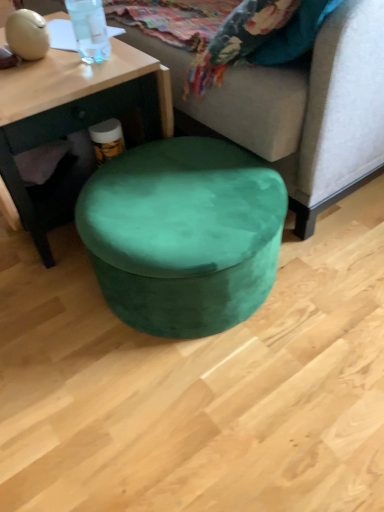
Where is `matte wood coffee table at center`? This screenshot has width=384, height=512. matte wood coffee table at center is located at coordinates (73, 109).

What do you see at coordinates (89, 29) in the screenshot? I see `transparent plastic bottle at upper left` at bounding box center [89, 29].

Find the location of `velvet green ottoman at center`. velvet green ottoman at center is located at coordinates (300, 108).

What do you see at coordinates (183, 234) in the screenshot?
I see `velvet green ottoman at center` at bounding box center [183, 234].

You are a GUI agent. You are given a task and a screenshot of the screen. Output one action in this format:
    pyautogui.click(x=<x>, y=<y>)
    Task: Click on the matte wood coffee table at center
    
    Given the screenshot: What is the action you would take?
    pyautogui.click(x=73, y=109)

Is there a large distance between matte wood coffee table at center and velvet green ottoman at center?

matte wood coffee table at center is near velvet green ottoman at center, not far away.

How many degrees apart are the facing directions of matte wood coffee table at center and velvet green ottoman at center?

The angle between the facing direction of matte wood coffee table at center and the facing direction of velvet green ottoman at center is 0.824 degrees.

Is matte wood coffee table at center positioned beyond the bounds of velvet green ottoman at center?

Yes.

Between point (10, 120) and point (335, 91), which one is positioned behind?

The point (335, 91) is farther.

In terms of width, does matte wood coffee table at center look wider or thinner when compared to velvet green ottoman at center?

matte wood coffee table at center is wider than velvet green ottoman at center.

Can you see matte wood coffee table at center touching velvet green ottoman at center?

They are not placed beside each other.

Could you tell me if matte wood coffee table at center is facing velvet green ottoman at center?

No, matte wood coffee table at center is not aimed at velvet green ottoman at center.

Would you say transparent plastic bottle at upper left is a long distance from velvet green ottoman at center?

No, transparent plastic bottle at upper left is not far away from velvet green ottoman at center.

Which object is closer to the camera, transparent plastic bottle at upper left or velvet green ottoman at center?

velvet green ottoman at center is closer to the camera.

Could you tell me if transparent plastic bottle at upper left is turned towards velvet green ottoman at center?

No, transparent plastic bottle at upper left is not facing towards velvet green ottoman at center.

Based on their sizes in the image, would you say velvet green ottoman at center is bigger or smaller than velvet green ottoman at center?

In the image, velvet green ottoman at center appears to be smaller than velvet green ottoman at center.

Which is more to the left, velvet green ottoman at center or velvet green ottoman at center?

From the viewer's perspective, velvet green ottoman at center appears more on the left side.

How different are the orientations of velvet green ottoman at center and velvet green ottoman at center in degrees?

The angular difference between velvet green ottoman at center and velvet green ottoman at center is 0.824 degrees.

Measure the distance from velvet green ottoman at center to velvet green ottoman at center.

They are 11.46 inches apart.

Which object is further away from the camera, matte wood coffee table at center or transparent plastic bottle at upper left?

matte wood coffee table at center is further away from the camera.

From the image's perspective, between matte wood coffee table at center and transparent plastic bottle at upper left, who is located below?

matte wood coffee table at center, from the image's perspective.

Can transparent plastic bottle at upper left be found inside matte wood coffee table at center?

That's incorrect, transparent plastic bottle at upper left is not inside matte wood coffee table at center.

Looking at their sizes, would you say transparent plastic bottle at upper left is wider or thinner than velvet green ottoman at center?

Considering their sizes, transparent plastic bottle at upper left looks slimmer than velvet green ottoman at center.

From a real-world perspective, which object rests below the other?

velvet green ottoman at center.

Is transparent plastic bottle at upper left further to camera compared to velvet green ottoman at center?

Yes, it is.

Considering the sizes of objects velvet green ottoman at center and velvet green ottoman at center in the image provided, who is shorter, velvet green ottoman at center or velvet green ottoman at center?

velvet green ottoman at center is shorter.

How different are the orientations of velvet green ottoman at center and velvet green ottoman at center in degrees?

The angle between the facing direction of velvet green ottoman at center and the facing direction of velvet green ottoman at center is 0.824 degrees.

Are velvet green ottoman at center and velvet green ottoman at center making contact?

No, velvet green ottoman at center is not beside velvet green ottoman at center.

Is velvet green ottoman at center positioned behind velvet green ottoman at center?

That is False.

Find the location of a particular element. studio couch lying above the matte wood coffee table at center (from the image's perspective) is located at coordinates (300, 108).

The width and height of the screenshot is (384, 512). I want to click on music stool located on the right of matte wood coffee table at center, so coord(183,234).

When comparing their distances from velvet green ottoman at center, does transparent plastic bottle at upper left or matte wood coffee table at center seem closer?

The object closer to velvet green ottoman at center is matte wood coffee table at center.

Considering their positions, is transparent plastic bottle at upper left positioned closer to matte wood coffee table at center than velvet green ottoman at center?

The object closer to matte wood coffee table at center is transparent plastic bottle at upper left.

From the image, which object appears to be farther from matte wood coffee table at center, velvet green ottoman at center or transparent plastic bottle at upper left?

Based on the image, velvet green ottoman at center appears to be further to matte wood coffee table at center.

Considering their positions, is velvet green ottoman at center positioned further to velvet green ottoman at center than matte wood coffee table at center?

matte wood coffee table at center is further to velvet green ottoman at center.

Which object lies nearer to the anchor point matte wood coffee table at center, velvet green ottoman at center or transparent plastic bottle at upper left?

The object closer to matte wood coffee table at center is transparent plastic bottle at upper left.

From the image, which object appears to be farther from transparent plastic bottle at upper left, velvet green ottoman at center or velvet green ottoman at center?

velvet green ottoman at center is further to transparent plastic bottle at upper left.

Which object lies further to the anchor point transparent plastic bottle at upper left, matte wood coffee table at center or velvet green ottoman at center?

velvet green ottoman at center is further to transparent plastic bottle at upper left.

Based on their spatial positions, is matte wood coffee table at center or transparent plastic bottle at upper left further from velvet green ottoman at center?

Result: The object further to velvet green ottoman at center is transparent plastic bottle at upper left.

In order to click on bottle between velvet green ottoman at center and velvet green ottoman at center in the vertical direction in this screenshot , I will do `click(89, 29)`.

The height and width of the screenshot is (512, 384). I want to click on coffee table between velvet green ottoman at center and velvet green ottoman at center from top to bottom, so click(x=73, y=109).

Where is `bottle between velvet green ottoman at center and matte wood coffee table at center in the up-down direction`? The height and width of the screenshot is (512, 384). bottle between velvet green ottoman at center and matte wood coffee table at center in the up-down direction is located at coordinates (89, 29).

Find the location of a particular element. The width and height of the screenshot is (384, 512). coffee table between transparent plastic bottle at upper left and velvet green ottoman at center from top to bottom is located at coordinates (73, 109).